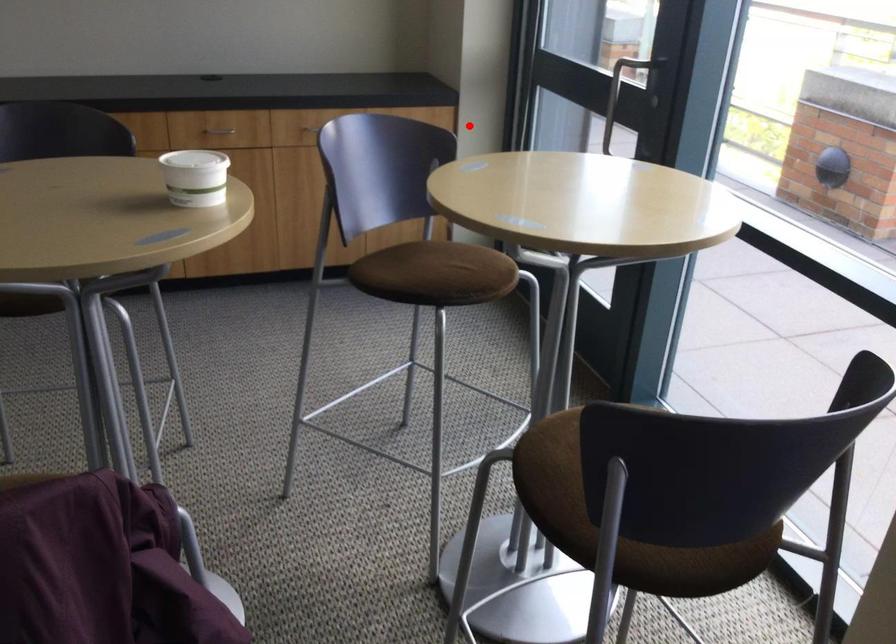
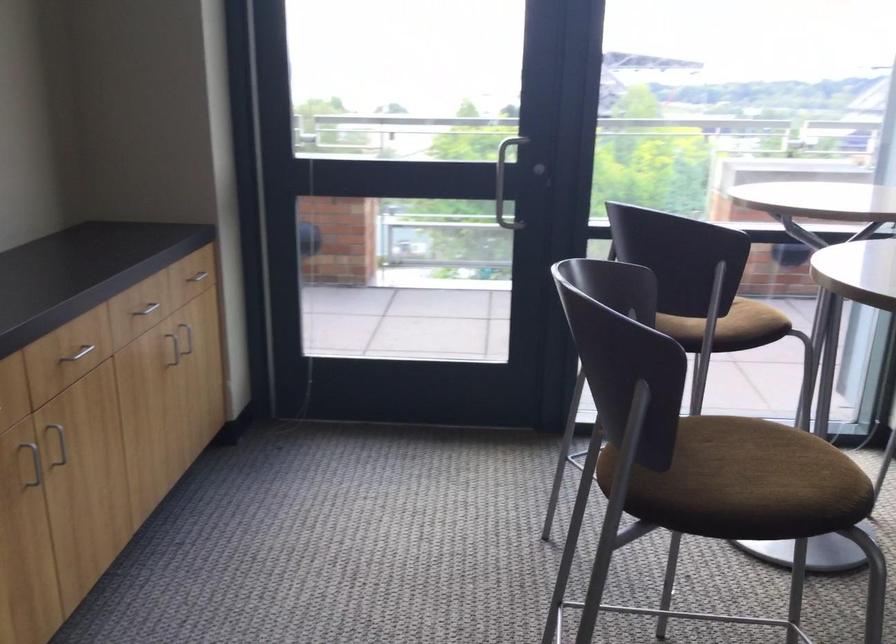
Find the pixel in the second image that matches the highlighted location in the first image.

(194, 279)